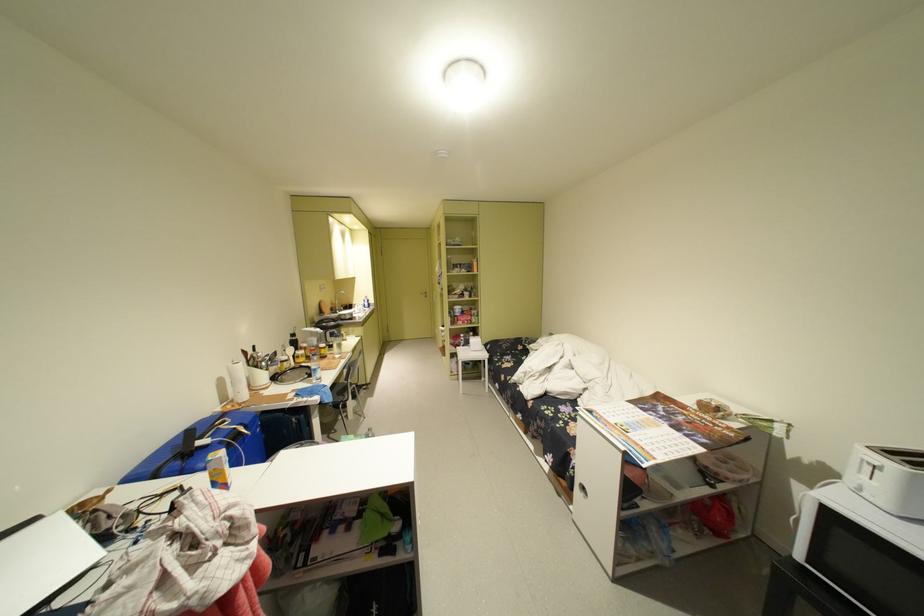
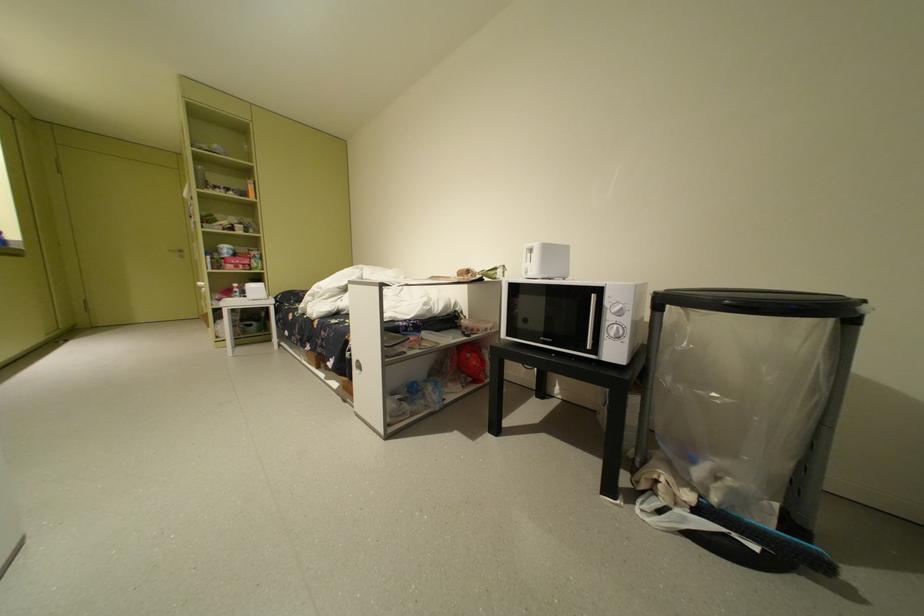
Question: The camera is either moving clockwise (left) or counter-clockwise (right) around the object. The first image is from the beginning of the video and the second image is from the end. Is the camera moving left or right when shooting the video?

Choices:
 (A) Left
 (B) Right

Answer: (A)